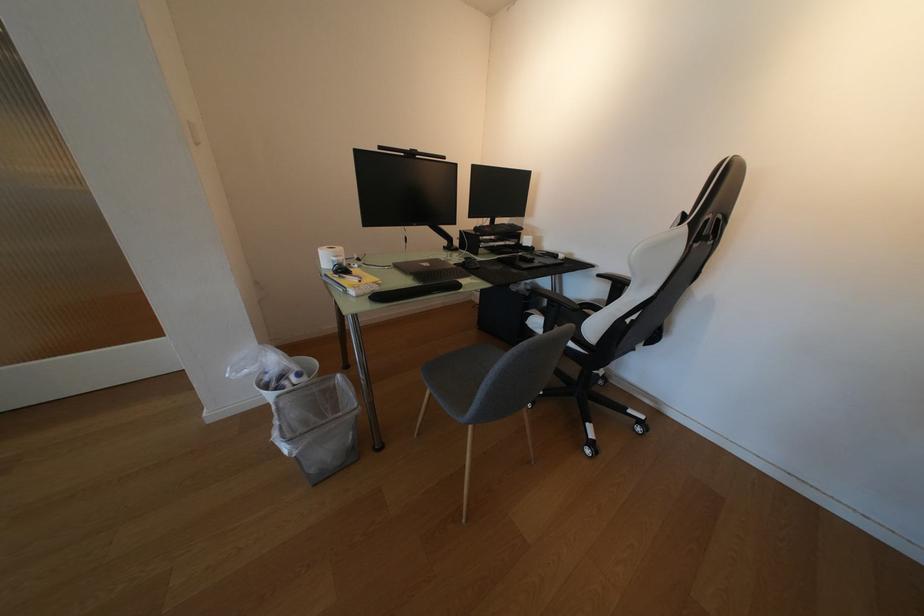
The image size is (924, 616). What do you see at coordinates (578, 314) in the screenshot?
I see `the grey chair sitting surface` at bounding box center [578, 314].